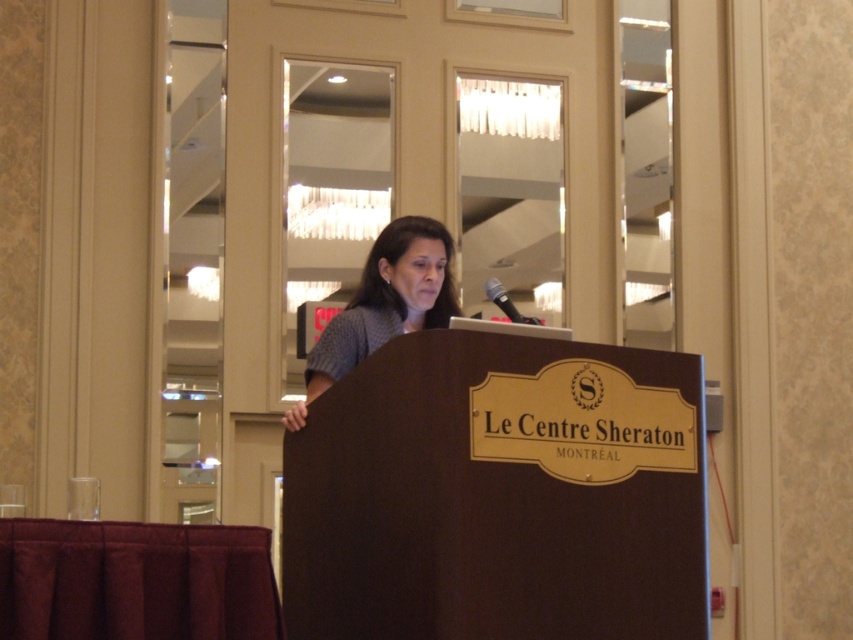
Question: Which point is farther to the camera?

Choices:
 (A) (366, 333)
 (B) (508, 300)

Answer: (A)

Question: Considering the relative positions of matte gray blouse at center and black metallic microphone at center in the image provided, where is matte gray blouse at center located with respect to black metallic microphone at center?

Choices:
 (A) right
 (B) left

Answer: (B)

Question: Among these points, which one is nearest to the camera?

Choices:
 (A) (335, 355)
 (B) (515, 314)

Answer: (B)

Question: Can you confirm if matte gray blouse at center is positioned to the right of black metallic microphone at center?

Choices:
 (A) yes
 (B) no

Answer: (B)

Question: Among these objects, which one is farthest from the camera?

Choices:
 (A) matte gray blouse at center
 (B) black metallic microphone at center

Answer: (A)

Question: Can you confirm if matte gray blouse at center is thinner than black metallic microphone at center?

Choices:
 (A) no
 (B) yes

Answer: (A)